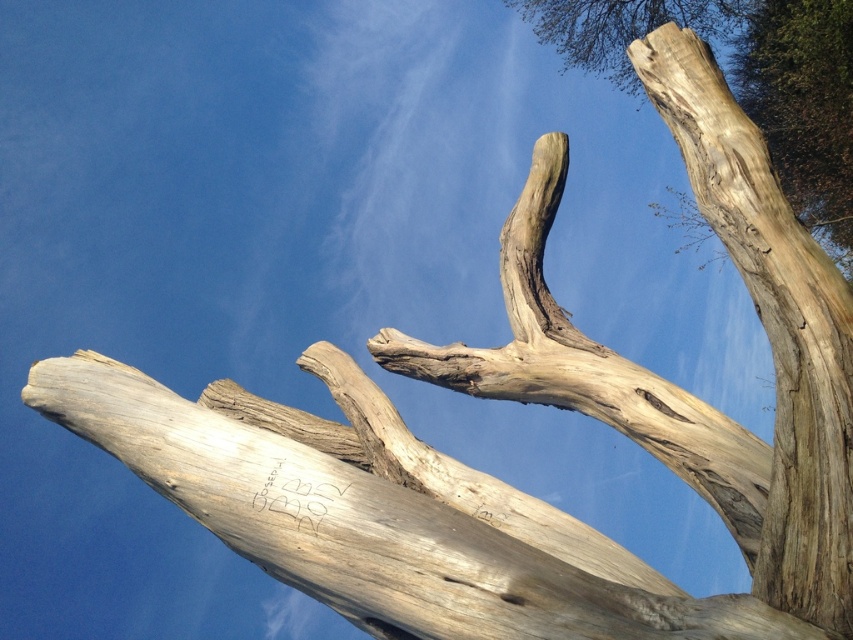
Who is taller, light brown wood at upper right or natural wood tree trunk at upper right?

With more height is natural wood tree trunk at upper right.

In the scene shown: Can you confirm if light brown wood at upper right is smaller than natural wood tree trunk at upper right?

Correct, light brown wood at upper right occupies less space than natural wood tree trunk at upper right.

The height and width of the screenshot is (640, 853). What are the coordinates of `light brown wood at upper right` in the screenshot? It's located at (773, 328).